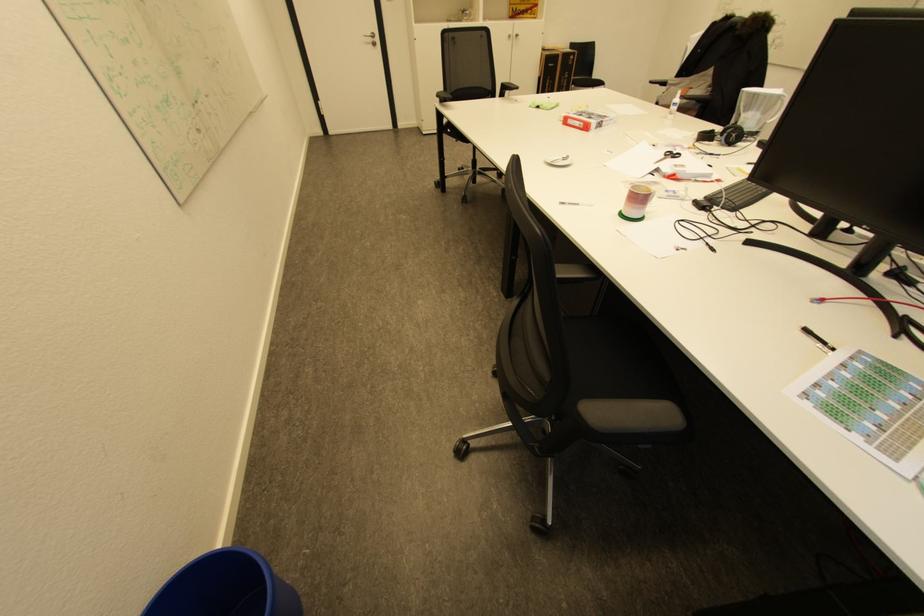
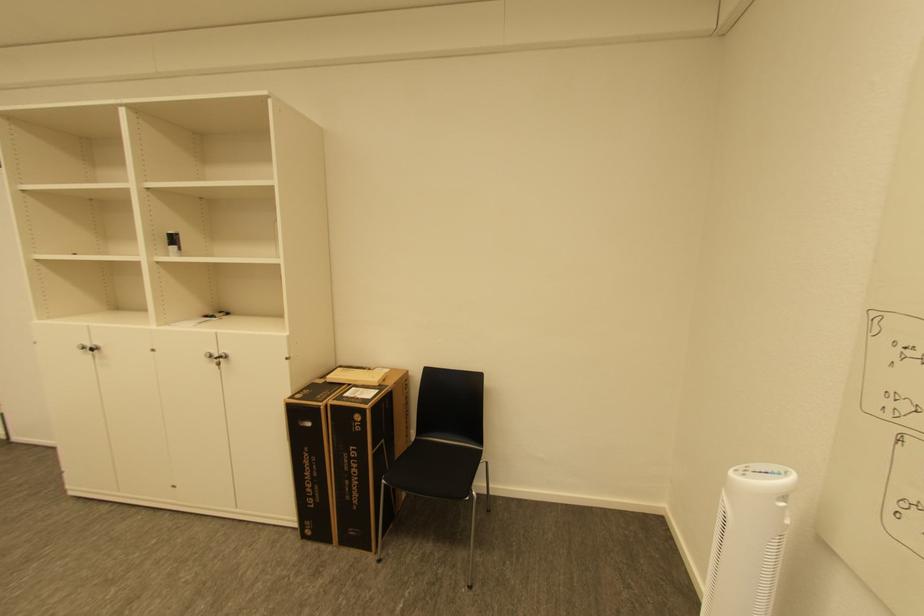
Locate, in the second image, the point that corresponds to [578,58] in the first image.

(363, 418)